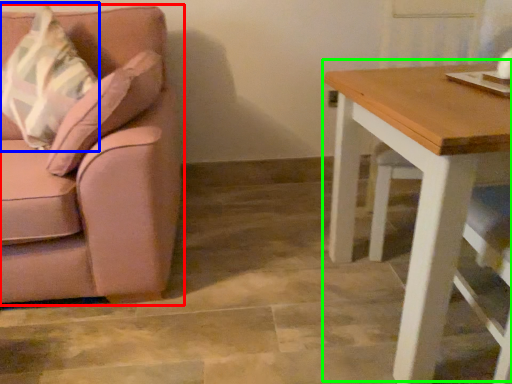
Question: Which is farther away from chair (highlighted by a red box)? throw pillow (highlighted by a blue box) or table (highlighted by a green box)?

Choices:
 (A) throw pillow
 (B) table

Answer: (B)